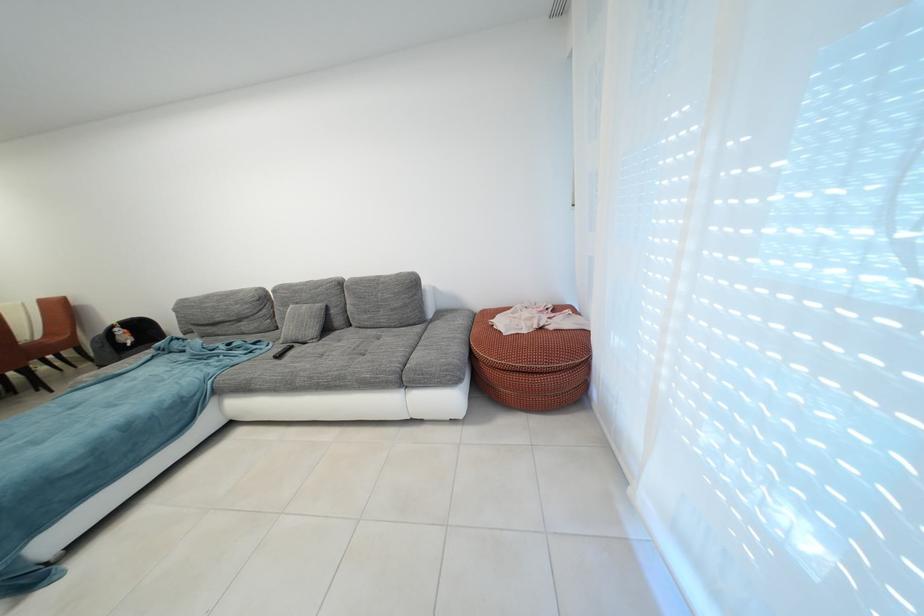
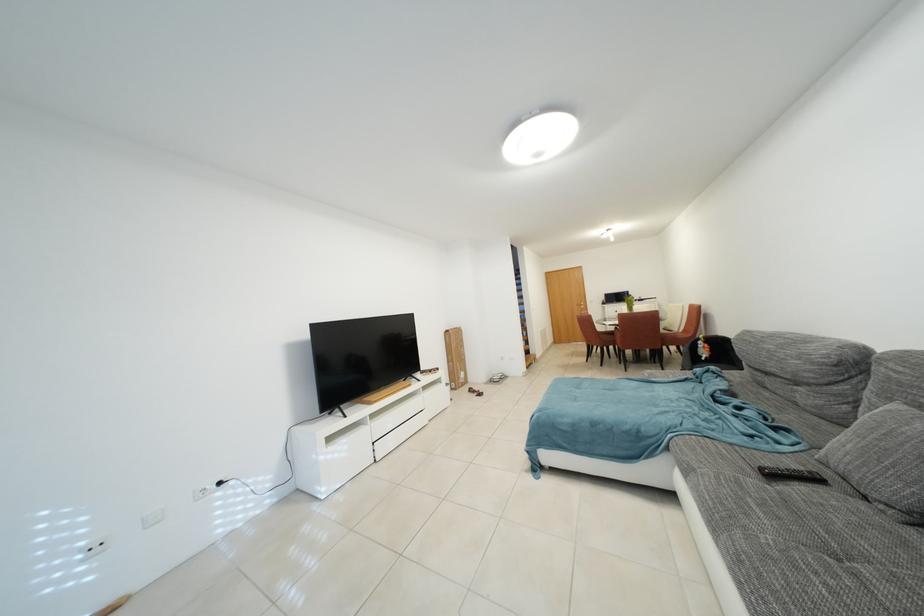
Question: The camera is either moving clockwise (left) or counter-clockwise (right) around the object. The first image is from the beginning of the video and the second image is from the end. Is the camera moving left or right when shooting the video?

Choices:
 (A) Left
 (B) Right

Answer: (B)